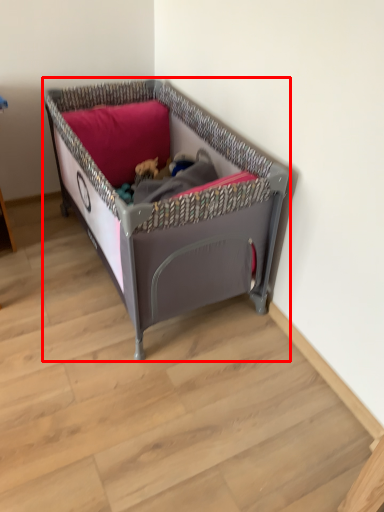
Question: From the image's perspective, where is infant bed (annotated by the red box) located relative to pillow?

Choices:
 (A) below
 (B) above

Answer: (A)